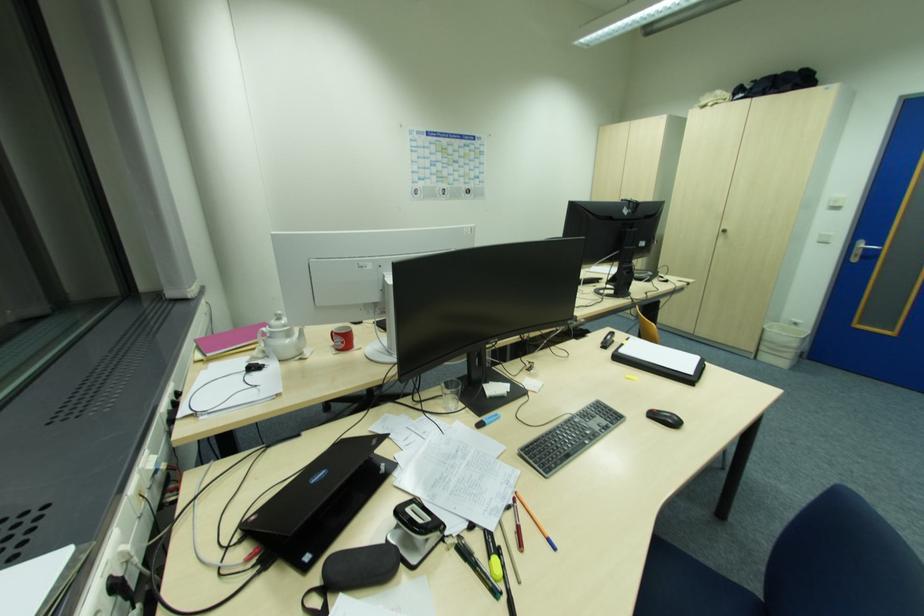
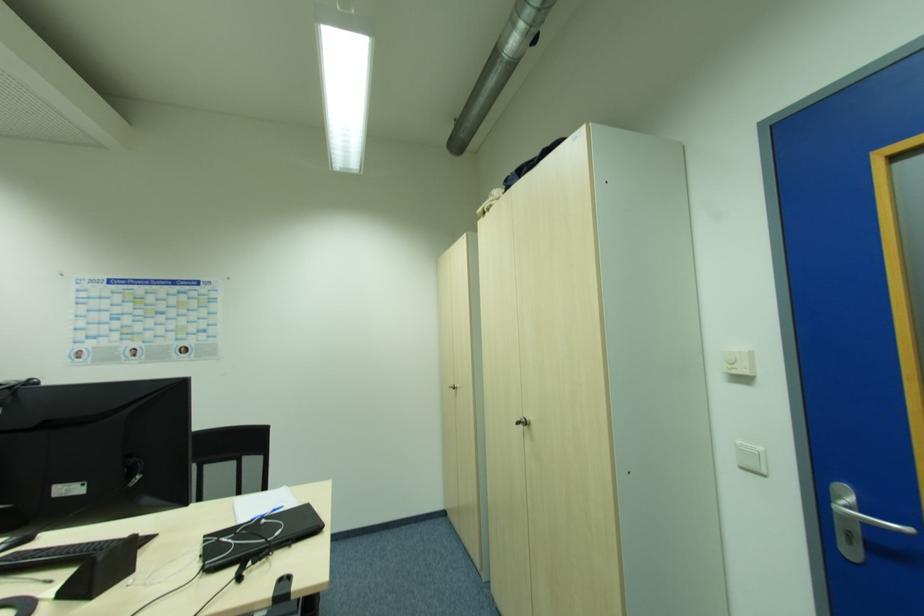
Locate, in the second image, the point that corresponds to (x=867, y=245) in the first image.

(855, 501)